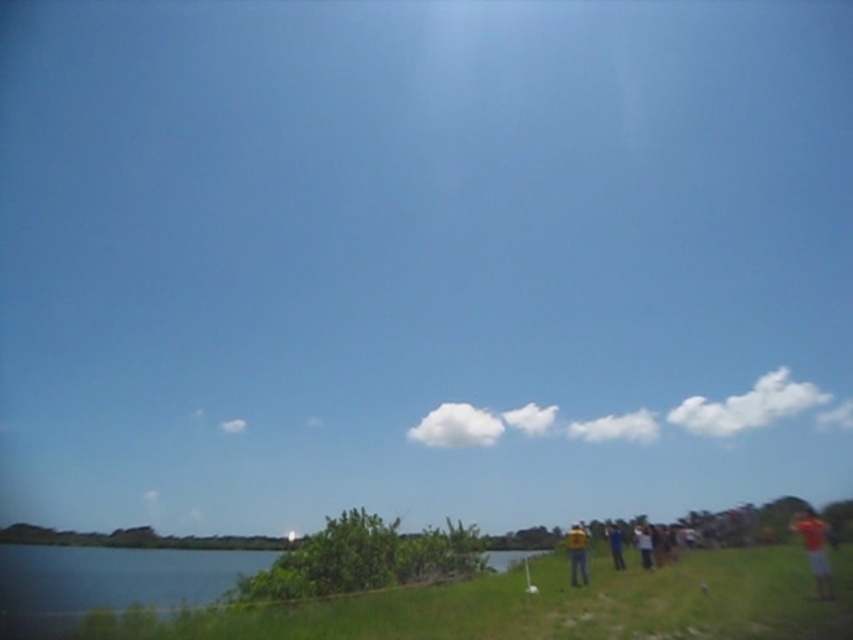
Between orange t-shirt at right and white cotton shirt at lower right, which one has less height?

orange t-shirt at right

Is orange t-shirt at right bigger than white cotton shirt at lower right?

Correct, orange t-shirt at right is larger in size than white cotton shirt at lower right.

Between point (830, 588) and point (637, 545), which one is positioned in front?

Point (830, 588)

This screenshot has width=853, height=640. Identify the location of orange t-shirt at right. (815, 548).

Is yellow fabric person at lower right below white cotton shirt at lower right?

Indeed, yellow fabric person at lower right is positioned under white cotton shirt at lower right.

Is yellow fabric person at lower right wider than white cotton shirt at lower right?

No, yellow fabric person at lower right is not wider than white cotton shirt at lower right.

This screenshot has height=640, width=853. What do you see at coordinates (577, 554) in the screenshot?
I see `yellow fabric person at lower right` at bounding box center [577, 554].

You are a GUI agent. You are given a task and a screenshot of the screen. Output one action in this format:
    pyautogui.click(x=<x>, y=<y>)
    Task: Click on the yellow fabric person at lower right
    This screenshot has height=640, width=853.
    Given the screenshot: What is the action you would take?
    pyautogui.click(x=577, y=554)

Which is behind, point (640, 540) or point (618, 548)?

The point (618, 548) is behind.

Looking at this image, who is higher up, white cotton shirt at lower right or yellow shirt at lower right?

white cotton shirt at lower right

This screenshot has height=640, width=853. I want to click on white cotton shirt at lower right, so click(643, 545).